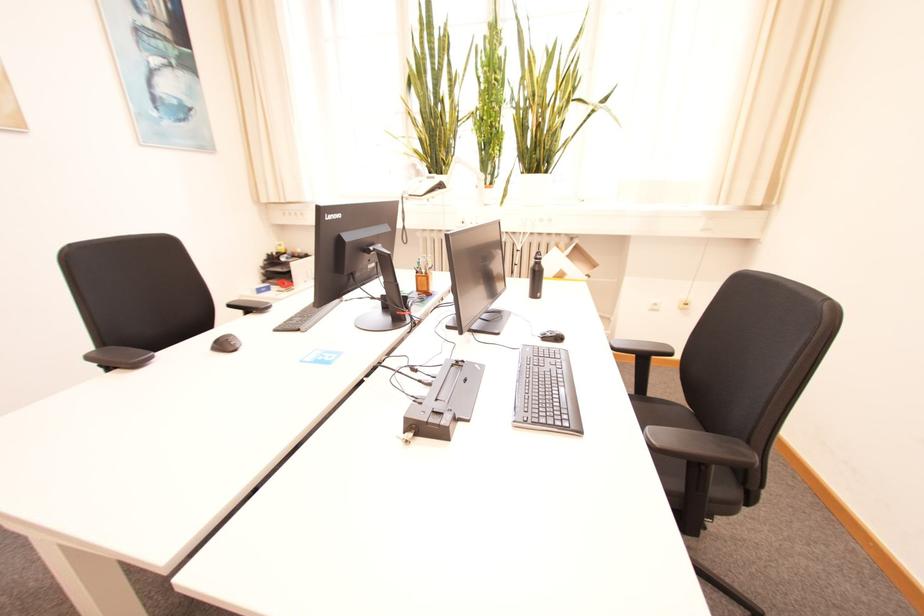
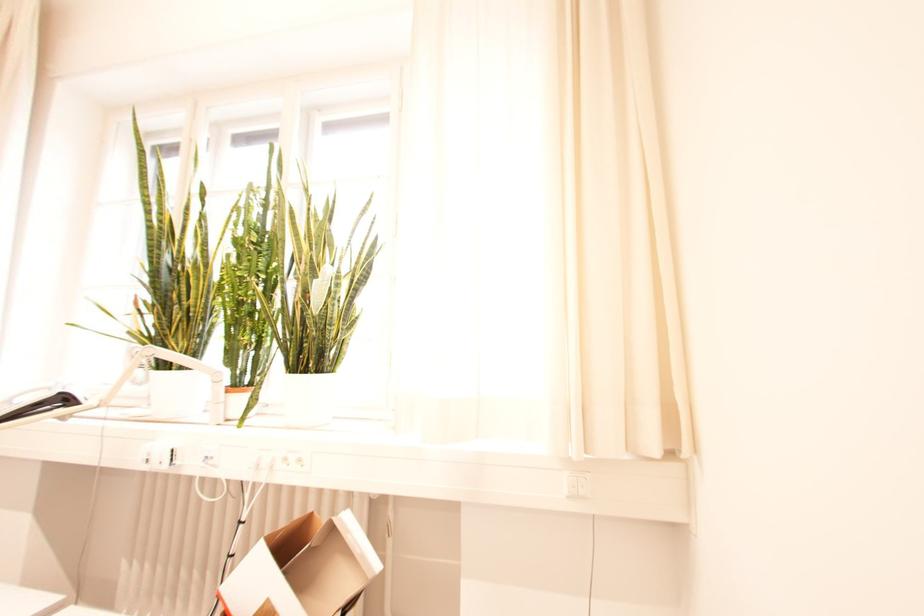
The images are taken continuously from a first-person perspective. In which direction are you moving?

The movement direction of the cameraman is right, forward.